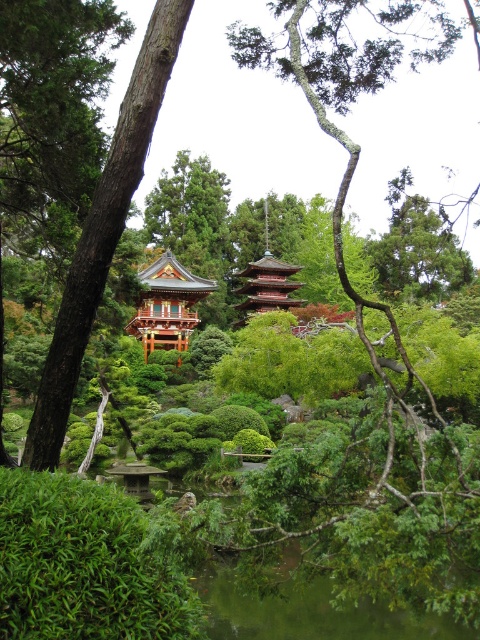
You are a visitor in the garden and want to take a photo of both the green textured tree at center and the shiny gold pagoda at center. Based on their positions, which one should you focus on first to ensure both are in the frame?

The green textured tree at center is positioned on the right side of the shiny gold pagoda at center, so you should focus on the shiny gold pagoda at center first to ensure both are in the frame.

You are standing in the garden and want to take a photo of the shiny gold pagoda at center without the green textured tree at center blocking the view. Is the pagoda visible behind the tree?

The green textured tree at center is closer to the viewer than the shiny gold pagoda at center, so the tree would block the view of the pagoda. You would need to move to a different position to see the pagoda without obstruction.